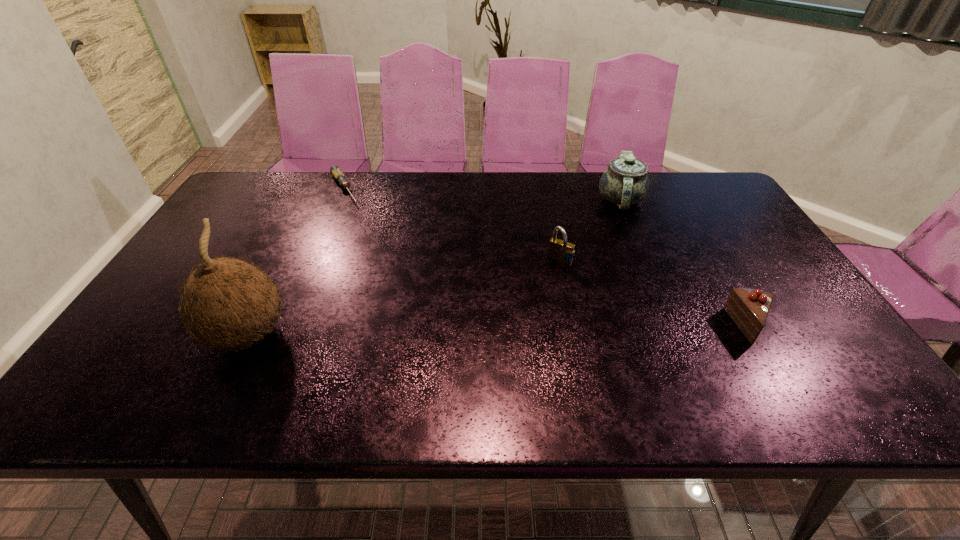
This screenshot has width=960, height=540. In order to click on vacant space on the desktop that is between the tallest object and the rightmost object and is positioned insert the shortest object into a screw head in this screenshot , I will do `click(439, 332)`.

Locate an element on the screen. vacant space on the desktop that is between the coconut and the rightmost object and is positioned on the side with the combination dials of the padlock is located at coordinates (517, 330).

This screenshot has height=540, width=960. I want to click on free spot on the desktop that is between the coconut and the second shortest object and is positioned from the spout of the fourth shortest object, so click(528, 330).